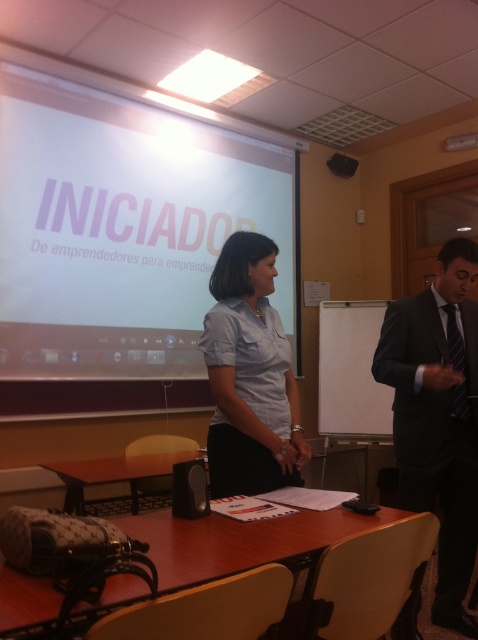
Locate an element on the screen. This screenshot has height=640, width=478. brown wooden table at lower center is located at coordinates (113, 474).

The image size is (478, 640). Describe the element at coordinates (113, 474) in the screenshot. I see `brown wooden table at lower center` at that location.

Locate an element on the screen. The image size is (478, 640). brown wooden table at lower center is located at coordinates (113, 474).

Does white matte projection screen at upper center appear under light blue shirt at center?

Incorrect, white matte projection screen at upper center is not positioned below light blue shirt at center.

Does white matte projection screen at upper center have a greater width compared to light blue shirt at center?

Correct, the width of white matte projection screen at upper center exceeds that of light blue shirt at center.

Locate an element on the screen. The image size is (478, 640). white matte projection screen at upper center is located at coordinates (125, 228).

Which is more to the left, light blue shirt at center or brown wood table at lower center?

brown wood table at lower center is more to the left.

Is light blue shirt at center thinner than brown wood table at lower center?

Indeed, light blue shirt at center has a lesser width compared to brown wood table at lower center.

Where is `light blue shirt at center`? The width and height of the screenshot is (478, 640). light blue shirt at center is located at coordinates (249, 376).